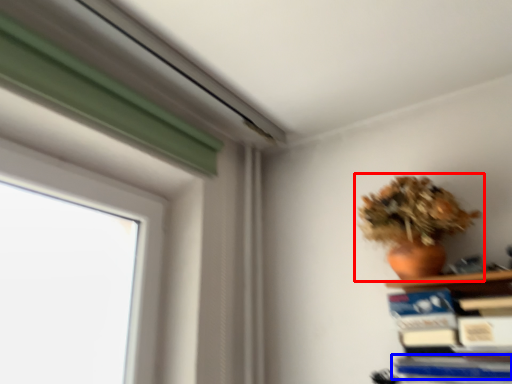
Question: Which point is closer to the camera, houseplant (highlighted by a red box) or paperback book (highlighted by a blue box)?

Choices:
 (A) houseplant
 (B) paperback book

Answer: (B)